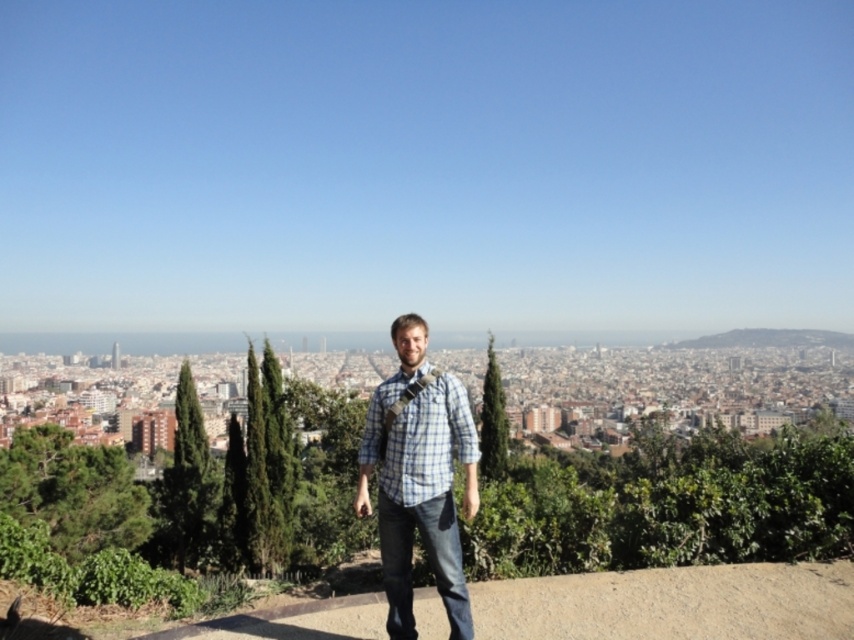
You are a fashion designer observing the city scene. You notice two shirts in the image, the blue plaid shirt at center and the plaid fabric shirt at center. Which one is bigger in size?

The blue plaid shirt at center is larger in size compared to the plaid fabric shirt at center.

You are a photographer trying to capture the cityscape in the background. You notice a person wearing a blue plaid shirt at center is standing on the pathway. To ensure the person remains in the frame while focusing on the city, where should you position the camera relative to the point marked at coordinates (419, 481)?

The blue plaid shirt at center is located at point (419, 481). To keep the person in the frame while focusing on the cityscape, position the camera so that the point (419, 481) is centered in the viewfinder. This ensures the person remains visible while allowing the background cityscape to be captured clearly.

You are a photographer trying to capture a candid shot of the person in the scene. You notice two shirts on the person, the blue plaid shirt at center and the plaid fabric shirt at center. Which shirt should you focus on to ensure it appears larger in your photo?

The blue plaid shirt at center is much taller than the plaid fabric shirt at center, so focusing on the blue plaid shirt at center will make it appear larger in the photo.